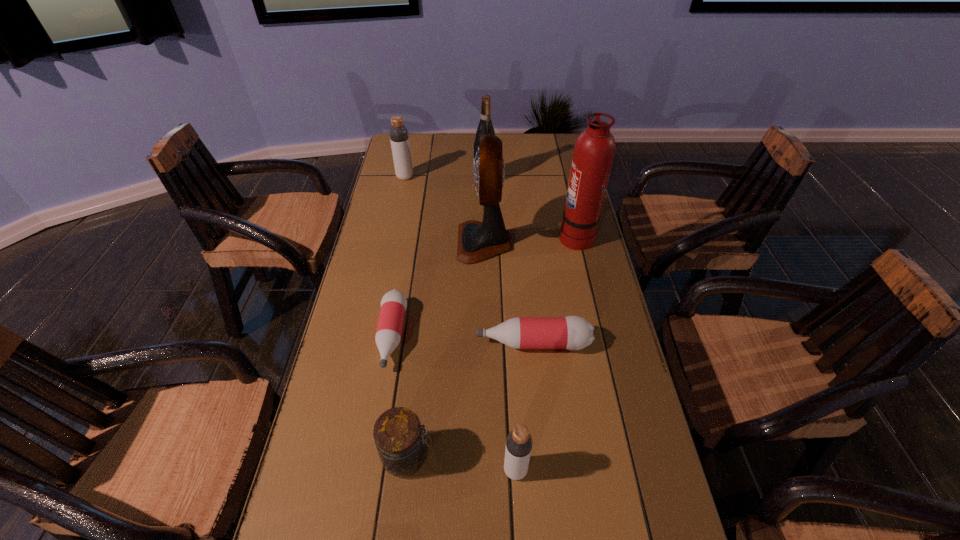
In order to click on free spot located on the left of the right gray bottle in this screenshot , I will do `click(324, 470)`.

You are a GUI agent. You are given a task and a screenshot of the screen. Output one action in this format:
    pyautogui.click(x=<x>, y=<y>)
    Task: Click on the free spot located 0.230m on the lid of the jar
    This screenshot has height=540, width=960.
    Given the screenshot: What is the action you would take?
    pyautogui.click(x=540, y=456)

I want to click on free space located with the cap open on the third tallest bottle, so click(x=441, y=343).

Identify the location of vacant space located with the cap open on the third tallest bottle. (448, 343).

Find the location of a particular element. The image size is (960, 540). blank space located 0.340m with the cap open on the third tallest bottle is located at coordinates (346, 343).

Where is `free space located 0.280m with the cap open on the left pink bottle`? The height and width of the screenshot is (540, 960). free space located 0.280m with the cap open on the left pink bottle is located at coordinates (365, 495).

Where is `jar located at the left edge`? jar located at the left edge is located at coordinates (401, 444).

At what (x,y) coordinates should I click in order to perform the action: click on fire extinguisher that is at the right edge. Please return your answer as a coordinate pair (x, y). This screenshot has width=960, height=540. Looking at the image, I should click on (594, 150).

Find the location of a particular element. This screenshot has width=960, height=540. bottle present at the right edge is located at coordinates (572, 332).

The width and height of the screenshot is (960, 540). Find the location of `vacant space at the far edge of the desktop`. vacant space at the far edge of the desktop is located at coordinates point(454,139).